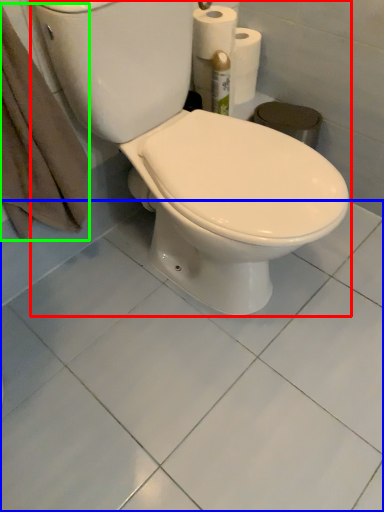
Question: Considering the real-world distances, which object is closest to toilet (highlighted by a red box)? ceramic tile (highlighted by a blue box) or bath towel (highlighted by a green box).

Choices:
 (A) ceramic tile
 (B) bath towel

Answer: (B)